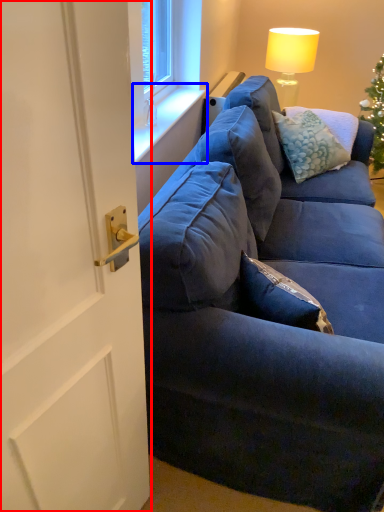
Question: Among these objects, which one is farthest to the camera, door (highlighted by a red box) or window sill (highlighted by a blue box)?

Choices:
 (A) door
 (B) window sill

Answer: (B)